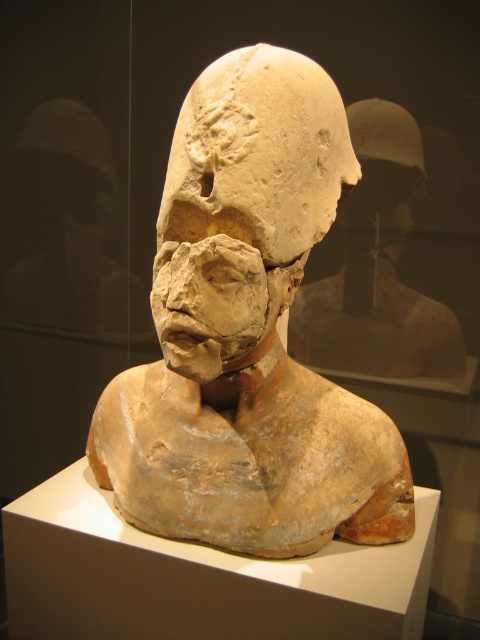
You are standing in front of the sculpture and want to touch the point at coordinates point (215,170). Considering the sculpture is on a pedestal, can you reach it without climbing?

The point (215,170) is 5.21 feet from the viewer. Since the average person is about 5.5 feet tall, you can reach up to approximately 5.5 feet. Therefore, you can reach the point (215,170) without climbing.

You are an art student analyzing the sculpture exhibit. You notice two sculptures labeled as earthenware sculpture at center and matte clay bust at center. Which one has a greater height?

The earthenware sculpture at center is much taller than the matte clay bust at center.

You are an art student standing in front of a sculpture in a museum. You need to sketch the matte clay head at center. Where should you position yourself to capture its central features accurately?

The matte clay head at center is located at point 0.322 on the x axis and 0.510 on the y axis, so you should position yourself directly in front of the point (244, 205) to capture its central features accurately.